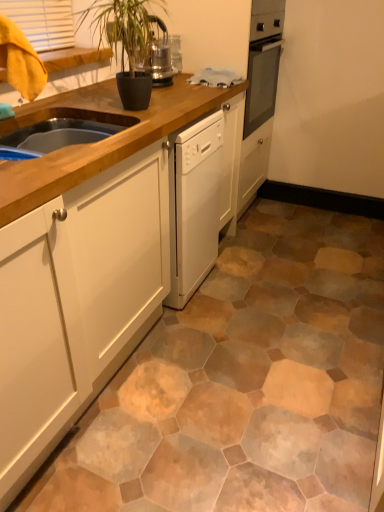
Question: From a real-world perspective, is white matte cabinet at center on dark green glossy plant at upper center?

Choices:
 (A) yes
 (B) no

Answer: (B)

Question: Is white matte cabinet at center completely or partially outside of dark green glossy plant at upper center?

Choices:
 (A) yes
 (B) no

Answer: (A)

Question: Is the depth of white matte cabinet at center greater than that of dark green glossy plant at upper center?

Choices:
 (A) yes
 (B) no

Answer: (B)

Question: From the image's perspective, would you say white matte cabinet at center is positioned over dark green glossy plant at upper center?

Choices:
 (A) no
 (B) yes

Answer: (A)

Question: Is white matte cabinet at center positioned before dark green glossy plant at upper center?

Choices:
 (A) no
 (B) yes

Answer: (B)

Question: Is white matte cabinet at center aimed at dark green glossy plant at upper center?

Choices:
 (A) yes
 (B) no

Answer: (B)

Question: Would you consider dark green glossy plant at upper center to be distant from white matte cabinet at center?

Choices:
 (A) yes
 (B) no

Answer: (B)

Question: Can you confirm if dark green glossy plant at upper center is wider than white matte cabinet at center?

Choices:
 (A) no
 (B) yes

Answer: (A)

Question: Is dark green glossy plant at upper center with white matte cabinet at center?

Choices:
 (A) yes
 (B) no

Answer: (B)

Question: Is dark green glossy plant at upper center oriented away from white matte cabinet at center?

Choices:
 (A) yes
 (B) no

Answer: (B)

Question: From a real-world perspective, is dark green glossy plant at upper center positioned under white matte cabinet at center based on gravity?

Choices:
 (A) no
 (B) yes

Answer: (A)

Question: Is dark green glossy plant at upper center shorter than white matte cabinet at center?

Choices:
 (A) yes
 (B) no

Answer: (A)

Question: Would you say dark green glossy plant at upper center is inside or outside white matte cabinet at center?

Choices:
 (A) outside
 (B) inside

Answer: (A)